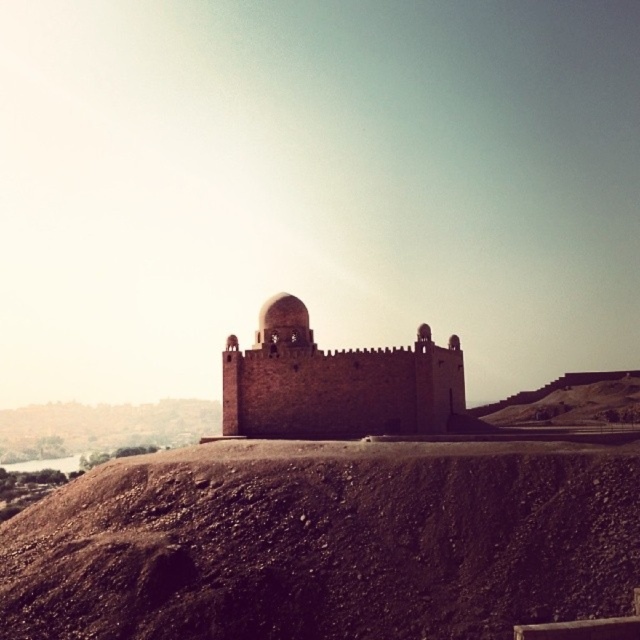
Question: Can you confirm if brown dirt mound at center is smaller than brown stone fort at center?

Choices:
 (A) yes
 (B) no

Answer: (B)

Question: Which point is closer to the camera?

Choices:
 (A) pyautogui.click(x=353, y=349)
 (B) pyautogui.click(x=205, y=490)
 (C) pyautogui.click(x=276, y=339)

Answer: (B)

Question: Is brown dirt mound at center smaller than brown stone fort at center?

Choices:
 (A) no
 (B) yes

Answer: (A)

Question: Which point is farther from the camera taking this photo?

Choices:
 (A) (300, 538)
 (B) (268, 314)

Answer: (B)

Question: Which of these objects is positioned farthest from the brown stone fort at center?

Choices:
 (A) matte stone dome at center
 (B) brown dirt mound at center

Answer: (B)

Question: Does brown dirt mound at center have a larger size compared to brown stone fort at center?

Choices:
 (A) yes
 (B) no

Answer: (A)